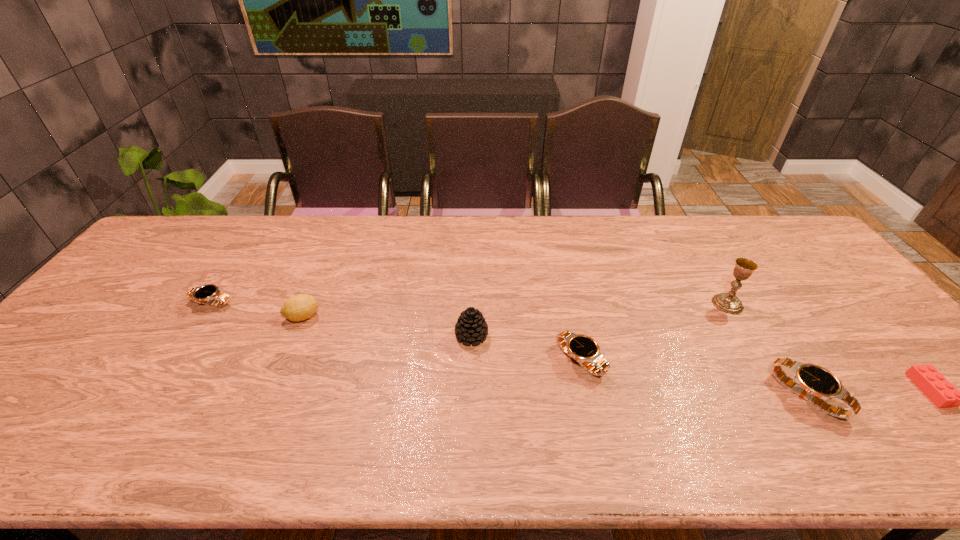
At what (x,y) coordinates should I click in order to perform the action: click on vacant area that lies between the tallest object and the leftmost object. Please return your answer as a coordinate pair (x, y). This screenshot has height=540, width=960. Looking at the image, I should click on 469,303.

I want to click on free spot between the tallest object and the rightmost watch, so click(x=767, y=350).

Where is `vacant area that lies between the pinecone and the farthest watch`? The width and height of the screenshot is (960, 540). vacant area that lies between the pinecone and the farthest watch is located at coordinates (342, 319).

I want to click on vacant area that lies between the lemon and the third shortest object, so (x=442, y=339).

Find the location of a particular element. The image size is (960, 540). free space between the second tallest watch and the shortest object is located at coordinates (756, 375).

Find the location of a particular element. This screenshot has height=540, width=960. free space between the rightmost watch and the lemon is located at coordinates (555, 356).

Locate an element on the screen. This screenshot has width=960, height=540. object that can be found as the sixth closest to the pinecone is located at coordinates (930, 381).

You are a GUI agent. You are given a task and a screenshot of the screen. Output one action in this format:
    pyautogui.click(x=<x>, y=<y>)
    Task: Click on the object that is the third closest to the tallest object
    The width and height of the screenshot is (960, 540).
    Given the screenshot: What is the action you would take?
    pyautogui.click(x=581, y=348)

You are a GUI agent. You are given a task and a screenshot of the screen. Output one action in this format:
    pyautogui.click(x=<x>, y=<y>)
    Task: Click on the watch object that ranks as the closest to the second shortest watch
    The height and width of the screenshot is (540, 960).
    Given the screenshot: What is the action you would take?
    pyautogui.click(x=811, y=382)

Locate which watch is the second closest to the chalice. Please provide its 2D coordinates. Your answer should be formatted as a tuple, i.e. [(x, y)], where the tuple contains the x and y coordinates of a point satisfying the conditions above.

[(581, 348)]